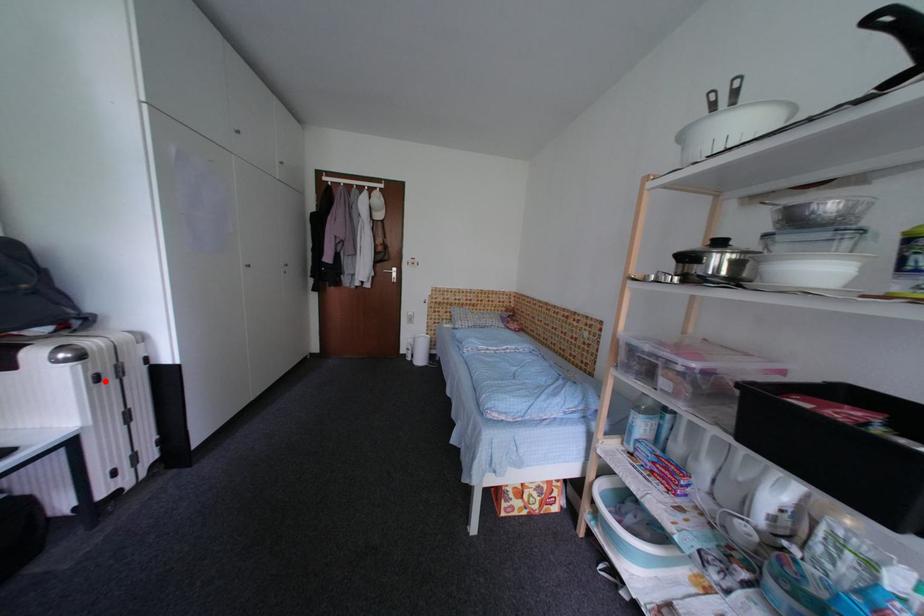
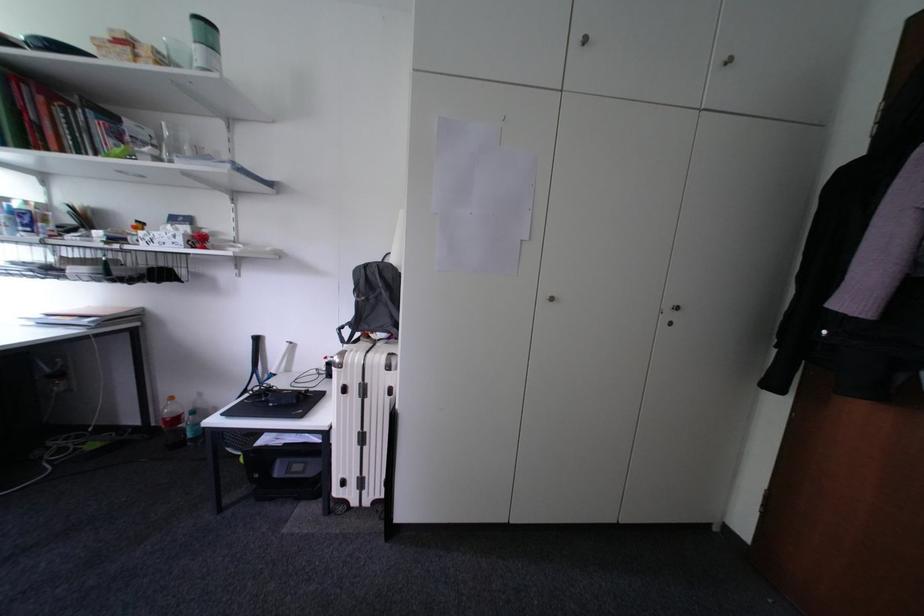
Question: I am providing you with two images of the same scene from different viewpoints. A red point is shown in image1. For the corresponding object point in image2, is it positioned nearer or farther from the camera?

Choices:
 (A) Nearer
 (B) Farther

Answer: (B)